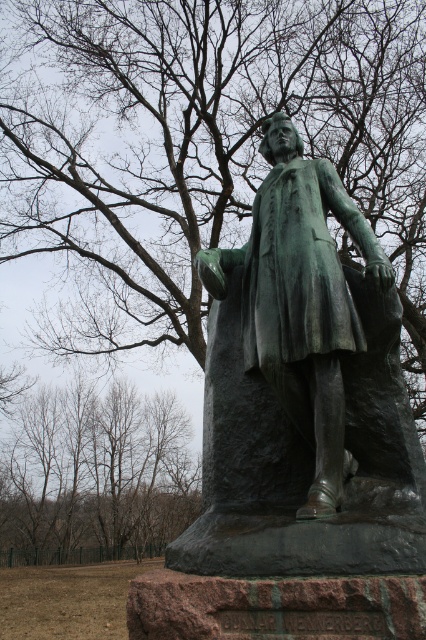
Question: Which object is farther from the camera taking this photo?

Choices:
 (A) brown leafless trees at lower left
 (B) green patina statue at center

Answer: (A)

Question: Is green patina statue at center to the right of brown leafless trees at lower left from the viewer's perspective?

Choices:
 (A) yes
 (B) no

Answer: (A)

Question: Can you confirm if green patina statue at center is smaller than brown leafless trees at lower left?

Choices:
 (A) yes
 (B) no

Answer: (A)

Question: Does green patina statue at center appear on the right side of brown leafless trees at lower left?

Choices:
 (A) no
 (B) yes

Answer: (B)

Question: Which point appears closest to the camera in this image?

Choices:
 (A) (x=299, y=212)
 (B) (x=5, y=467)

Answer: (A)